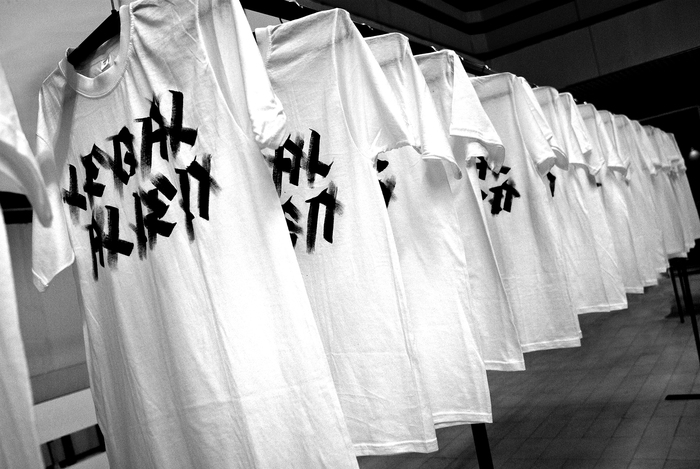
Image resolution: width=700 pixels, height=469 pixels. Identify the location of walls. (663, 95), (45, 335).